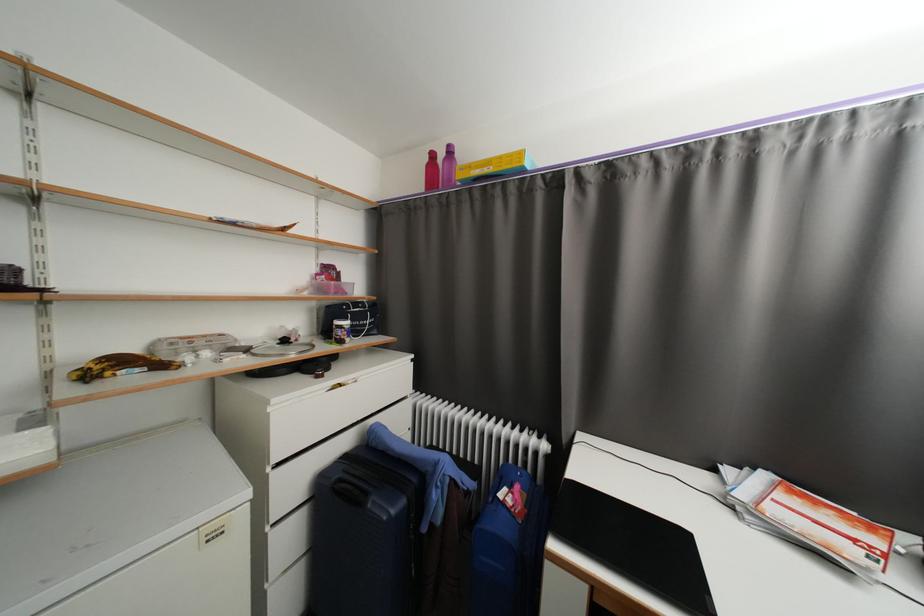
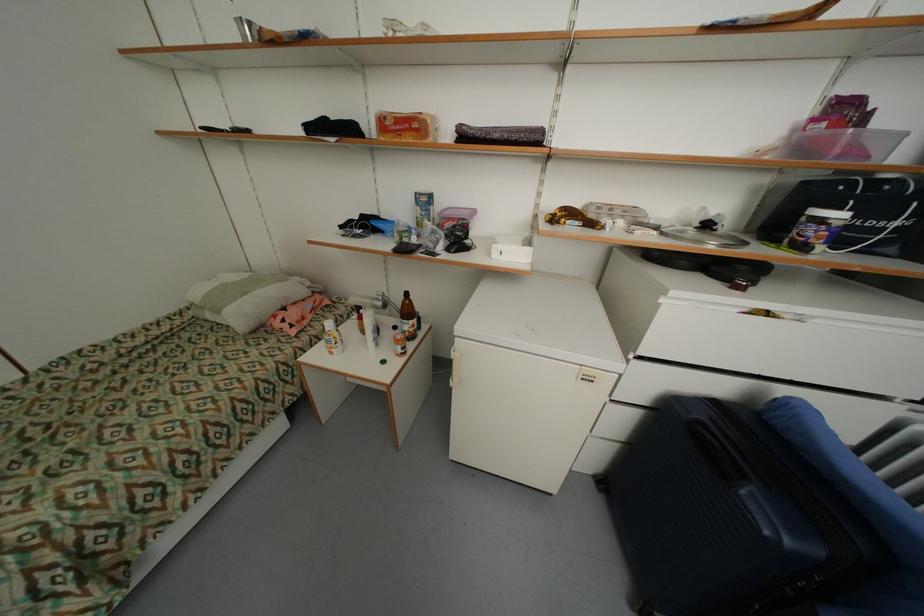
In the second image, find the point that corresponds to the point at 290,342 in the first image.

(713, 227)